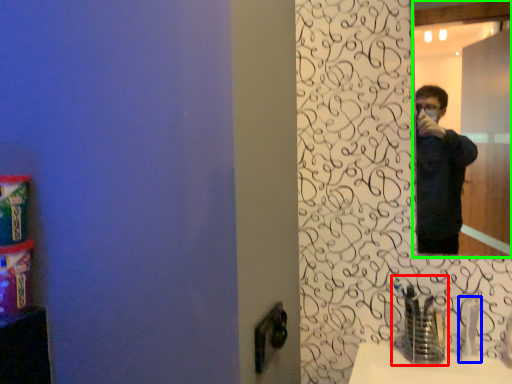
Question: Which object is the closest to the faucet (highlighted by a red box)? Choose among these: faucet (highlighted by a blue box) or mirror (highlighted by a green box).

Choices:
 (A) faucet
 (B) mirror

Answer: (A)